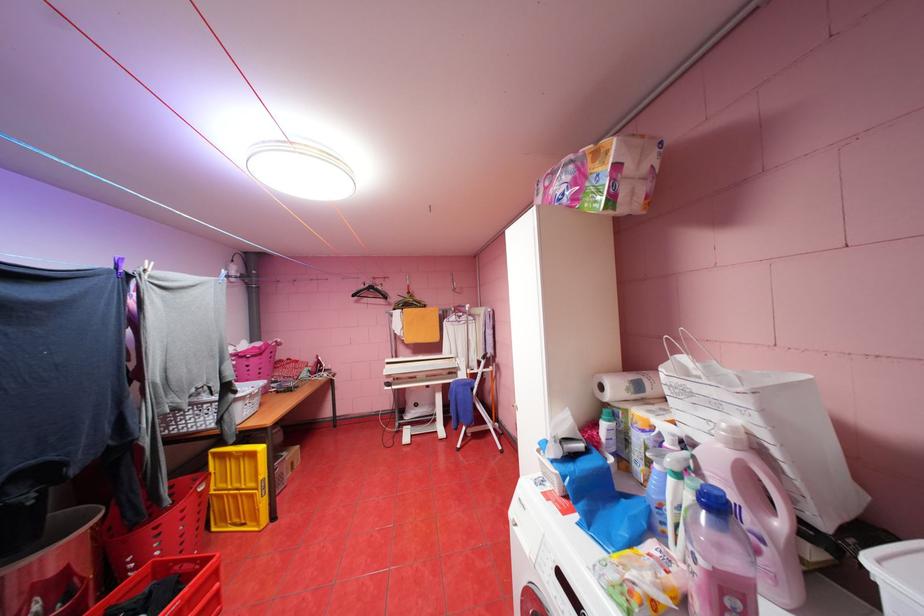
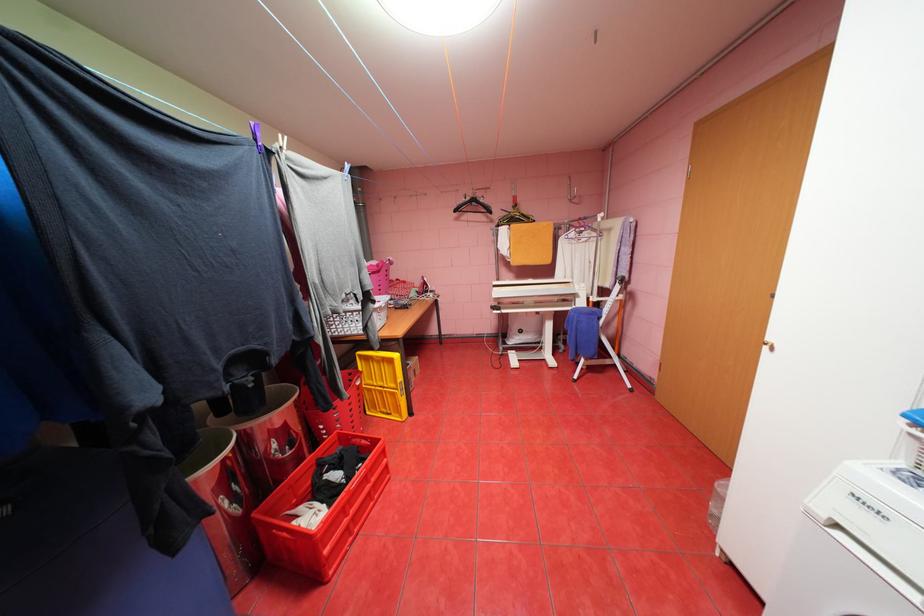
Based on the continuous images, in which direction is the camera rotating?

The rotation direction of the camera is left-down.